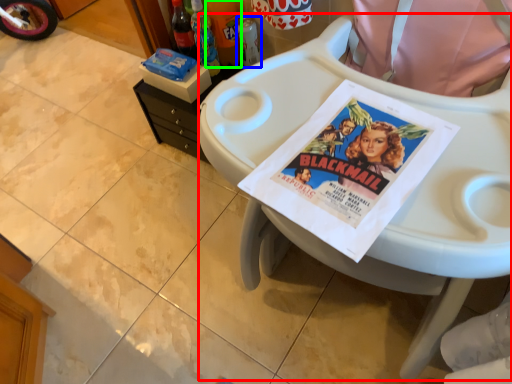
Question: Based on their relative distances, which object is farther from feeding chair (highlighted by a red box)? Choose from bottle (highlighted by a blue box) and bottle (highlighted by a green box).

Choices:
 (A) bottle
 (B) bottle

Answer: (B)